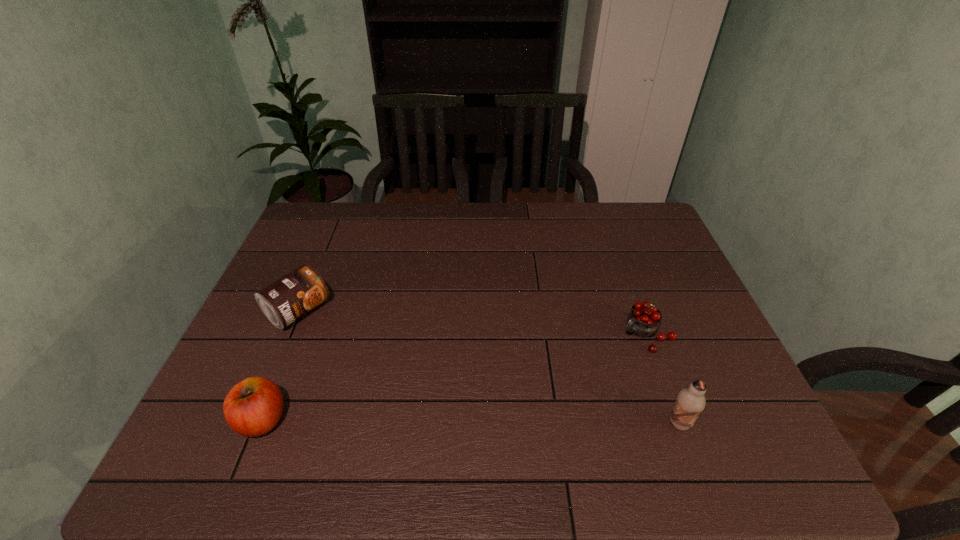
At what (x,y) coordinates should I click in order to perform the action: click on free location located on the handle side of the pot filled with cherries. Please return your answer as a coordinate pair (x, y). This screenshot has width=960, height=540. Looking at the image, I should click on (605, 364).

The image size is (960, 540). Find the location of `blank space located 0.050m on the handle side of the pot filled with cherries`. blank space located 0.050m on the handle side of the pot filled with cherries is located at coordinates (615, 356).

This screenshot has height=540, width=960. I want to click on apple at the near edge, so click(x=253, y=407).

Identify the location of chocolate milk located in the near edge section of the desktop. The width and height of the screenshot is (960, 540). (690, 402).

At what (x,y) coordinates should I click in order to perform the action: click on apple that is at the left edge. Please return your answer as a coordinate pair (x, y). Looking at the image, I should click on (253, 407).

You are a GUI agent. You are given a task and a screenshot of the screen. Output one action in this format:
    pyautogui.click(x=<x>, y=<y>)
    Task: Click on the can at the left edge
    
    Given the screenshot: What is the action you would take?
    pyautogui.click(x=284, y=301)

Locate an element on the screen. chocolate milk located at the right edge is located at coordinates (690, 402).

This screenshot has width=960, height=540. Find the location of `pot filled with cherries that is positioned at the right edge`. pot filled with cherries that is positioned at the right edge is located at coordinates (644, 319).

Image resolution: width=960 pixels, height=540 pixels. I want to click on object positioned at the near left corner, so click(253, 407).

Identify the location of object present at the near right corner. The height and width of the screenshot is (540, 960). (690, 402).